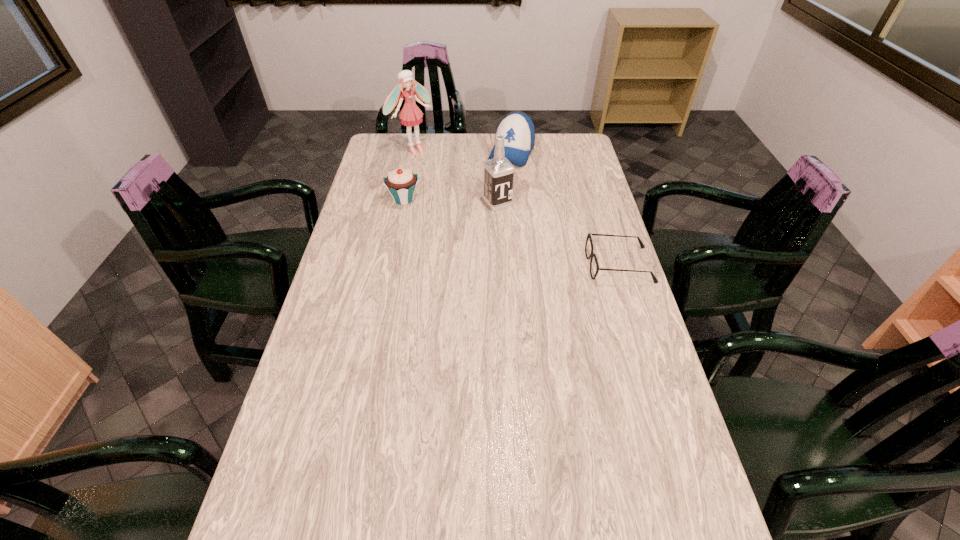
Where is `object positioned at the right edge`? This screenshot has width=960, height=540. object positioned at the right edge is located at coordinates (589, 235).

At what (x,y) coordinates should I click in order to perform the action: click on object that is positioned at the far left corner. Please return your answer as a coordinate pair (x, y). This screenshot has width=960, height=540. Looking at the image, I should click on [411, 115].

You are a GUI agent. You are given a task and a screenshot of the screen. Output one action in this format:
    pyautogui.click(x=<x>, y=<y>)
    Task: Click on the vacant space at the near edge of the desktop
    The height and width of the screenshot is (540, 960).
    Given the screenshot: What is the action you would take?
    pyautogui.click(x=461, y=521)

The width and height of the screenshot is (960, 540). Find the location of `vacant area at the left edge`. vacant area at the left edge is located at coordinates (376, 315).

Where is `vacant space at the right edge of the desktop`? vacant space at the right edge of the desktop is located at coordinates 593,233.

The height and width of the screenshot is (540, 960). What are the coordinates of `vacant space at the far left corner of the desktop` in the screenshot? It's located at (399, 148).

Where is `vacant space at the far right corner`? The width and height of the screenshot is (960, 540). vacant space at the far right corner is located at coordinates pyautogui.click(x=556, y=159).

At what (x,y) coordinates should I click in order to perform the action: click on free space between the doll and the baseball cap. Please return your answer as a coordinate pair (x, y). The width and height of the screenshot is (960, 540). Looking at the image, I should click on (463, 151).

Where is `free space between the cupcake and the spectacles`? free space between the cupcake and the spectacles is located at coordinates (512, 232).

At what (x,y) coordinates should I click in order to perform the action: click on free area in between the vodka and the shortest object. Please return your answer as a coordinate pair (x, y). Looking at the image, I should click on (559, 234).